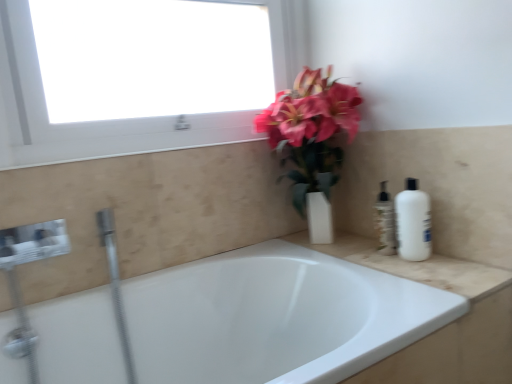
Question: In the image, is translucent plastic soap dispenser at right on the left side or the right side of white glossy bathtub at center?

Choices:
 (A) left
 (B) right

Answer: (B)

Question: Is translucent plastic soap dispenser at right in front of or behind white glossy bathtub at center in the image?

Choices:
 (A) behind
 (B) front

Answer: (A)

Question: Estimate the real-world distances between objects in this image. Which object is closer to the white glossy bathtub at center?

Choices:
 (A) white matte bottle at right
 (B) matte white vase at upper center
 (C) translucent plastic soap dispenser at right
 (D) beige marble counter top at upper right
 (E) white glossy window at upper left

Answer: (D)

Question: Which of these objects is positioned closest to the beige marble counter top at upper right?

Choices:
 (A) matte white vase at upper center
 (B) white glossy window at upper left
 (C) translucent plastic soap dispenser at right
 (D) white glossy bathtub at center
 (E) white matte bottle at right

Answer: (E)